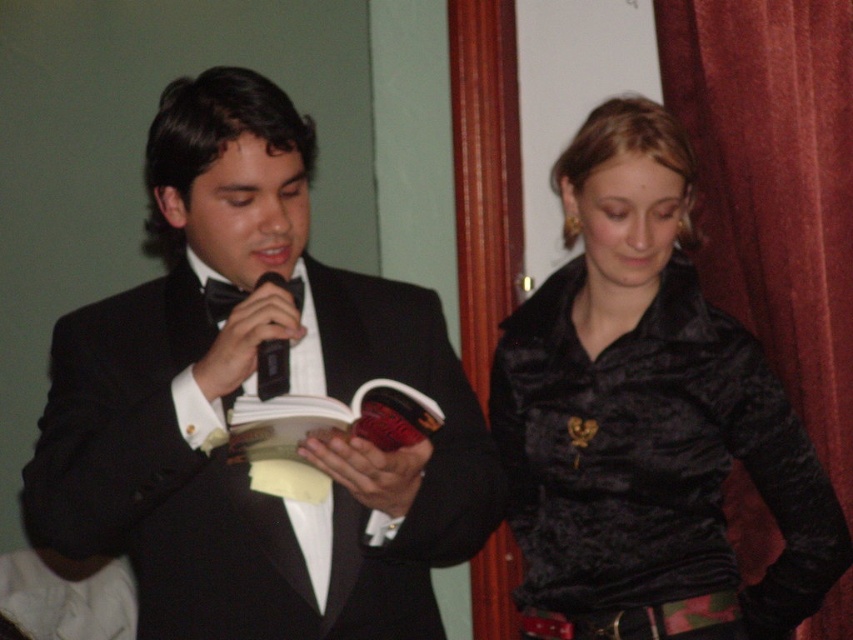
Who is more forward, (701, 486) or (817, 148)?

Point (701, 486)

In the scene shown: Which is more to the left, black velvet jacket at center or velvet red curtain at right?

black velvet jacket at center is more to the left.

The image size is (853, 640). What do you see at coordinates (647, 416) in the screenshot?
I see `black velvet jacket at center` at bounding box center [647, 416].

Find the location of `black velvet jacket at center`. black velvet jacket at center is located at coordinates (647, 416).

Does black satin tuxedo at center have a larger size compared to velvet red curtain at right?

Yes.

Can you confirm if black satin tuxedo at center is wider than velvet red curtain at right?

Yes.

Between point (448, 340) and point (740, 496), which one is positioned behind?

Point (740, 496)

Locate an element on the screen. black satin tuxedo at center is located at coordinates 238,392.

Is point (688, 545) less distant than point (280, 374)?

No.

Is point (639, 196) positioned in front of point (281, 388)?

No.

The image size is (853, 640). Identify the location of black velvet jacket at center. (647, 416).